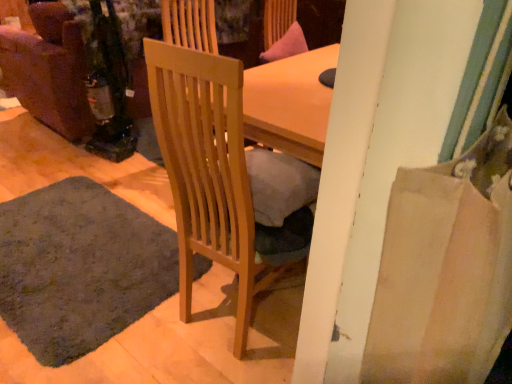
Question: Should I look upward or downward to see light wood chair at center?

Choices:
 (A) down
 (B) up

Answer: (A)

Question: Is dark gray carpet at lower left directly adjacent to light wood chair at center?

Choices:
 (A) yes
 (B) no

Answer: (B)

Question: From a real-world perspective, is dark gray carpet at lower left positioned under light wood chair at center based on gravity?

Choices:
 (A) no
 (B) yes

Answer: (B)

Question: Considering the relative positions of dark gray carpet at lower left and light wood chair at center in the image provided, is dark gray carpet at lower left to the right of light wood chair at center from the viewer's perspective?

Choices:
 (A) no
 (B) yes

Answer: (A)

Question: From a real-world perspective, is dark gray carpet at lower left over light wood chair at center?

Choices:
 (A) yes
 (B) no

Answer: (B)

Question: Can you confirm if dark gray carpet at lower left is wider than light wood chair at center?

Choices:
 (A) yes
 (B) no

Answer: (A)

Question: Is dark gray carpet at lower left far away from light wood chair at center?

Choices:
 (A) no
 (B) yes

Answer: (A)

Question: Can you confirm if light wood chair at center is wider than dark gray carpet at lower left?

Choices:
 (A) no
 (B) yes

Answer: (A)

Question: Can you confirm if light wood chair at center is positioned to the left of dark gray carpet at lower left?

Choices:
 (A) yes
 (B) no

Answer: (B)

Question: Considering the relative positions of light wood chair at center and dark gray carpet at lower left in the image provided, is light wood chair at center in front of dark gray carpet at lower left?

Choices:
 (A) yes
 (B) no

Answer: (A)

Question: Can you confirm if light wood chair at center is shorter than dark gray carpet at lower left?

Choices:
 (A) yes
 (B) no

Answer: (B)

Question: Does light wood chair at center have a larger size compared to dark gray carpet at lower left?

Choices:
 (A) yes
 (B) no

Answer: (A)

Question: From the image's perspective, is light wood chair at center on dark gray carpet at lower left?

Choices:
 (A) no
 (B) yes

Answer: (B)

Question: Is point (5, 301) positioned closer to the camera than point (193, 196)?

Choices:
 (A) farther
 (B) closer

Answer: (A)